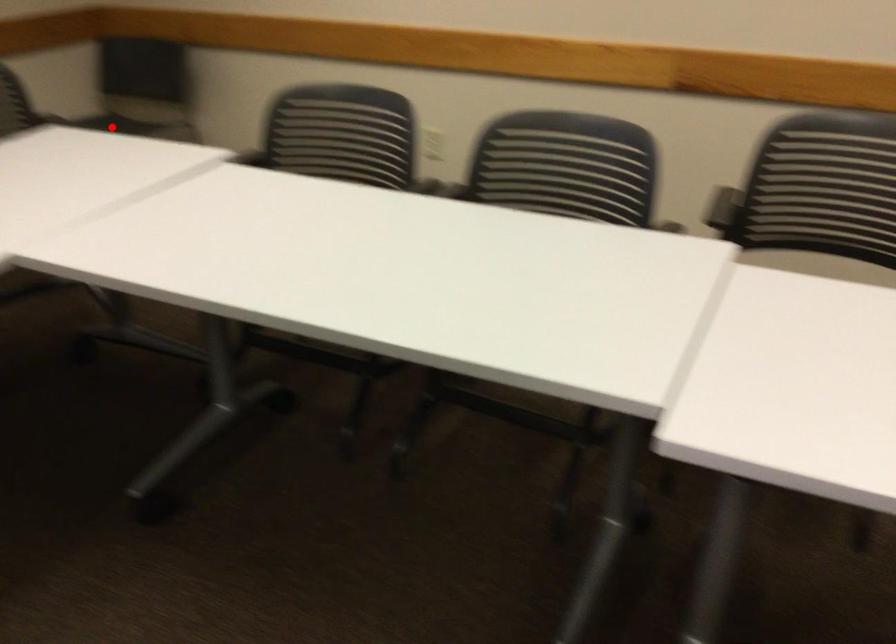
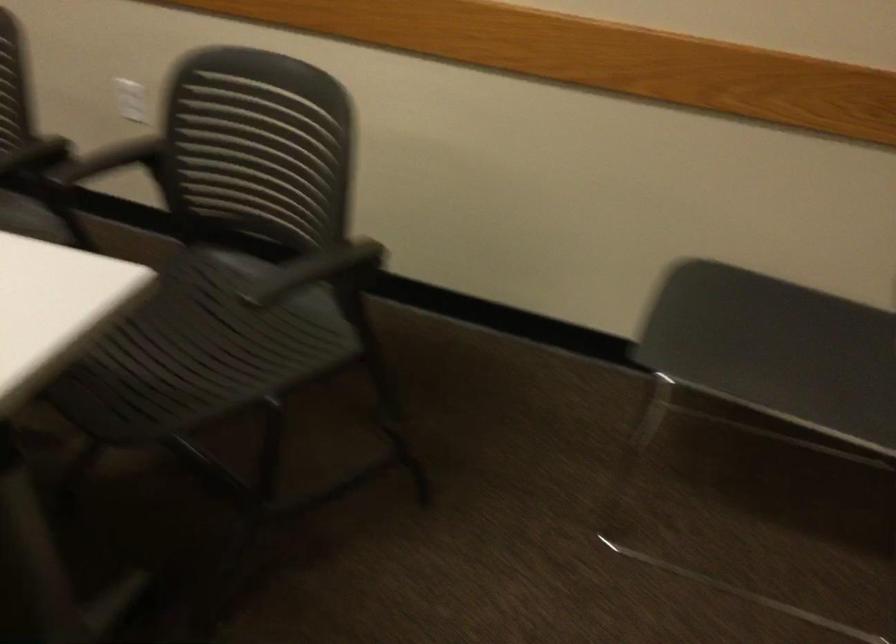
Where in the second image is the point corresponding to the highlighted location from the first image?

(714, 323)